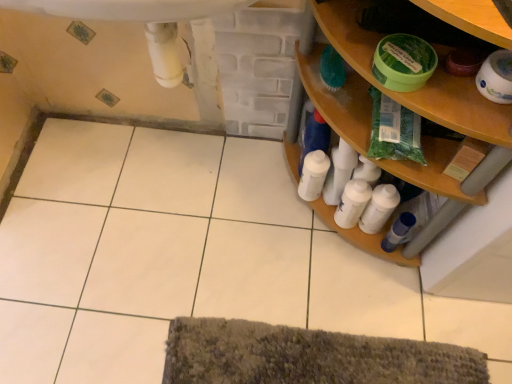
Question: Is there a large distance between white glossy toilet paper at upper right and green plastic bag at upper right?

Choices:
 (A) no
 (B) yes

Answer: (A)

Question: From the image's perspective, is white glossy toilet paper at upper right over green plastic bag at upper right?

Choices:
 (A) yes
 (B) no

Answer: (A)

Question: From a real-world perspective, is white glossy toilet paper at upper right on top of green plastic bag at upper right?

Choices:
 (A) no
 (B) yes

Answer: (B)

Question: Would you say green plastic bag at upper right is part of white glossy toilet paper at upper right's contents?

Choices:
 (A) no
 (B) yes

Answer: (A)

Question: Does white glossy toilet paper at upper right appear on the left side of green plastic bag at upper right?

Choices:
 (A) no
 (B) yes

Answer: (A)

Question: Is white glossy toilet paper at upper right looking in the opposite direction of green plastic bag at upper right?

Choices:
 (A) yes
 (B) no

Answer: (B)

Question: From the image's perspective, is blue glossy bottle at lower right, which appears as the first toiletry when viewed from the right, on wooden shelf at right?

Choices:
 (A) no
 (B) yes

Answer: (A)

Question: Is blue glossy bottle at lower right, arranged as the 3th toiletry when viewed from the left, bigger than wooden shelf at right?

Choices:
 (A) no
 (B) yes

Answer: (A)

Question: Is blue glossy bottle at lower right, which appears as the first toiletry when viewed from the right, to the right of wooden shelf at right from the viewer's perspective?

Choices:
 (A) yes
 (B) no

Answer: (A)

Question: Is blue glossy bottle at lower right, arranged as the 3th toiletry when viewed from the left, shorter than wooden shelf at right?

Choices:
 (A) yes
 (B) no

Answer: (A)

Question: Considering the relative sizes of blue glossy bottle at lower right, arranged as the 3th toiletry when viewed from the left, and wooden shelf at right in the image provided, is blue glossy bottle at lower right, arranged as the 3th toiletry when viewed from the left, taller than wooden shelf at right?

Choices:
 (A) yes
 (B) no

Answer: (B)

Question: Would you say blue glossy bottle at lower right, which appears as the first toiletry when viewed from the right, contains wooden shelf at right?

Choices:
 (A) yes
 (B) no

Answer: (B)

Question: Could you tell me if white glossy bottle at lower right, the first toiletry when ordered from left to right, is turned towards wooden shelf at right?

Choices:
 (A) yes
 (B) no

Answer: (A)